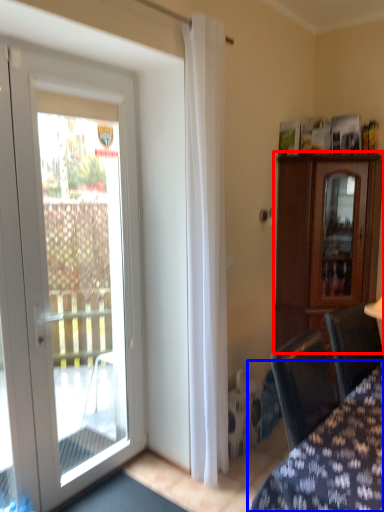
Question: Which object appears closest to the camera in this image, cabinetry (highlighted by a red box) or furniture (highlighted by a blue box)?

Choices:
 (A) cabinetry
 (B) furniture

Answer: (B)